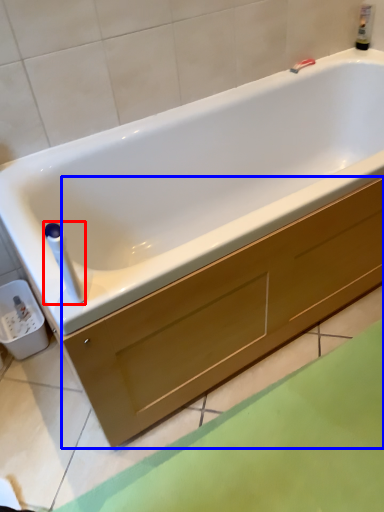
Question: Which of the following is the farthest to the observer, towel bar (highlighted by a red box) or drawer (highlighted by a blue box)?

Choices:
 (A) towel bar
 (B) drawer

Answer: (A)